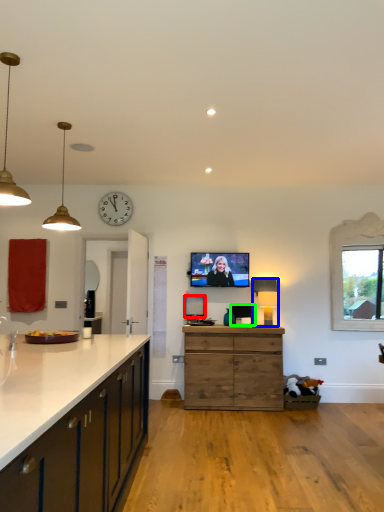
Question: Considering the real-world distances, which object is closest to picture frame (highlighted by a red box)? lamp (highlighted by a blue box) or picture frame (highlighted by a green box).

Choices:
 (A) lamp
 (B) picture frame

Answer: (B)